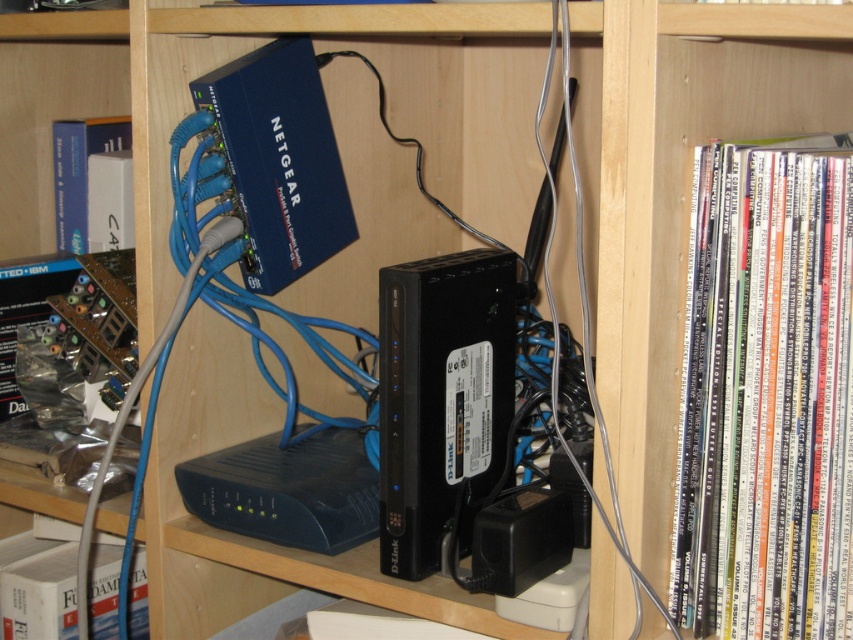
Question: Which object is farther from the camera taking this photo?

Choices:
 (A) white matte book at left
 (B) white paper book at lower left

Answer: (A)

Question: Does white paper book at lower left appear over white matte book at left?

Choices:
 (A) yes
 (B) no

Answer: (B)

Question: Which point is closer to the camera taking this photo?

Choices:
 (A) (62, 138)
 (B) (107, 620)
 (C) (749, 513)

Answer: (C)

Question: Which object is positioned farthest from the white paper book at lower left?

Choices:
 (A) white paperbacks at right
 (B) white matte book at left

Answer: (A)

Question: Does white paperbacks at right lie behind white paper book at lower left?

Choices:
 (A) yes
 (B) no

Answer: (B)

Question: Where is white paper book at lower left located in relation to white matte book at left in the image?

Choices:
 (A) left
 (B) right

Answer: (B)